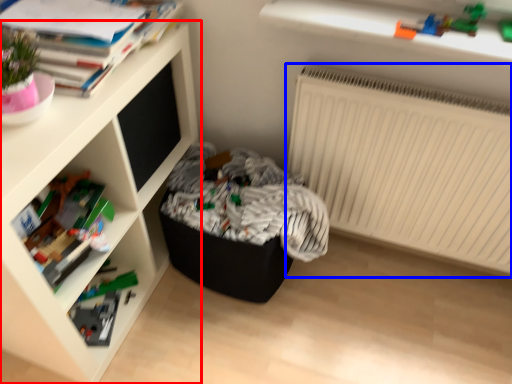
Question: Among these objects, which one is nearest to the camera, shelf (highlighted by a red box) or radiator (highlighted by a blue box)?

Choices:
 (A) shelf
 (B) radiator

Answer: (A)